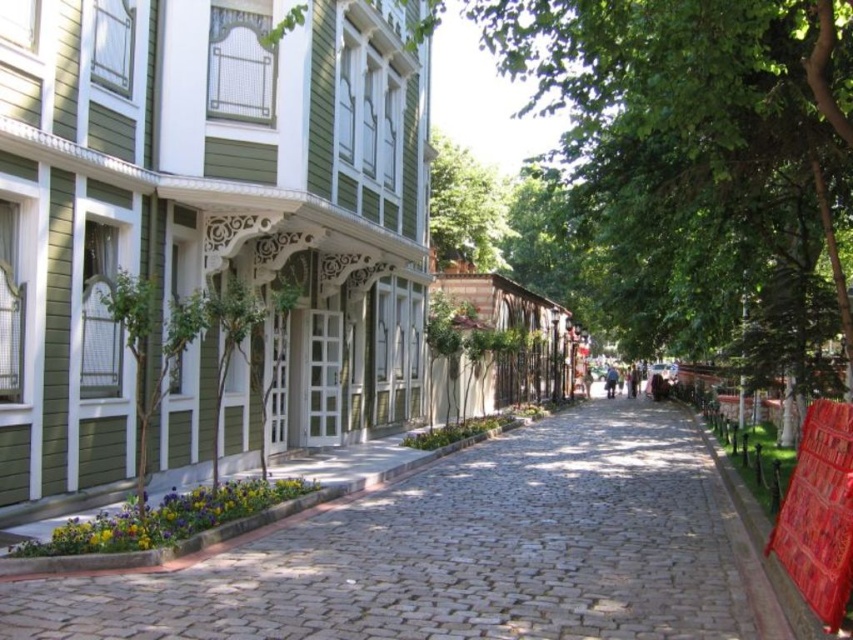
Question: Which point is farther to the camera?

Choices:
 (A) (589, 120)
 (B) (466, 246)

Answer: (B)

Question: Where is cobblestone pavement at center located in relation to green leafy tree at center in the image?

Choices:
 (A) right
 (B) left

Answer: (B)

Question: Which of the following is the farthest from the observer?

Choices:
 (A) green leafy tree at upper center
 (B) green leafy tree at center

Answer: (A)

Question: Does green leafy tree at center appear under green leafy tree at upper center?

Choices:
 (A) no
 (B) yes

Answer: (A)

Question: Which point is farther to the camera?

Choices:
 (A) (643, 144)
 (B) (318, 557)

Answer: (A)

Question: Does cobblestone pavement at center have a greater width compared to green leafy tree at upper center?

Choices:
 (A) no
 (B) yes

Answer: (B)